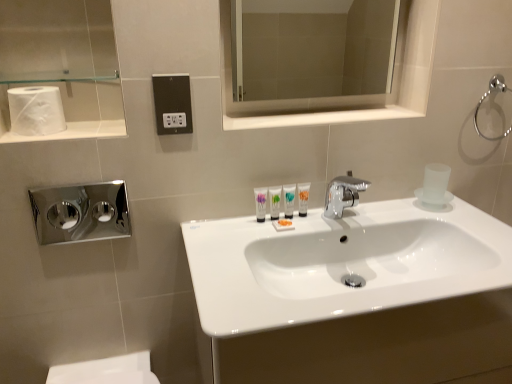
The width and height of the screenshot is (512, 384). Identify the location of vacant point to the right of translucent plastic mouthwash at center, the 2th mouthwash positioned from the left. (343, 218).